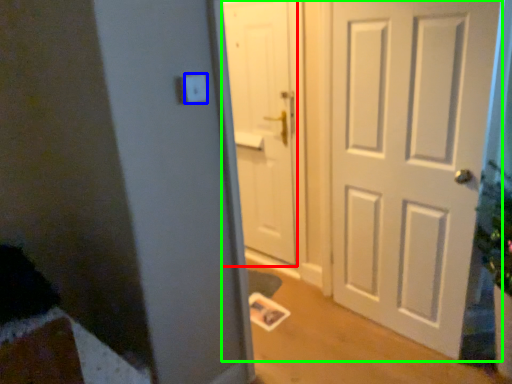
Question: Which is nearer to the door (highlighted by a red box)? light switch (highlighted by a blue box) or door (highlighted by a green box).

Choices:
 (A) light switch
 (B) door

Answer: (B)